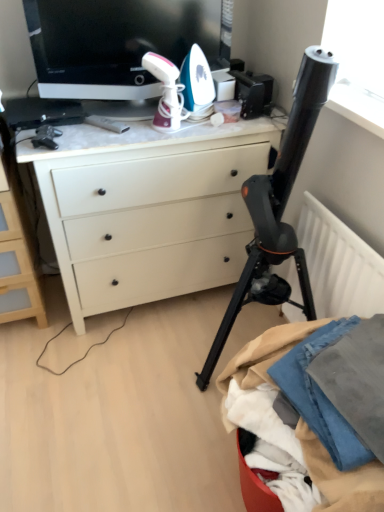
Question: From a real-world perspective, is denim fabric at lower right located beneath black glossy television at upper center?

Choices:
 (A) no
 (B) yes

Answer: (B)

Question: Is denim fabric at lower right completely or partially outside of black glossy television at upper center?

Choices:
 (A) no
 (B) yes

Answer: (B)

Question: Can you confirm if denim fabric at lower right is positioned to the right of black glossy television at upper center?

Choices:
 (A) yes
 (B) no

Answer: (A)

Question: Is denim fabric at lower right touching black glossy television at upper center?

Choices:
 (A) no
 (B) yes

Answer: (A)

Question: Does denim fabric at lower right have a greater height compared to black glossy television at upper center?

Choices:
 (A) no
 (B) yes

Answer: (A)

Question: From the image's perspective, is denim fabric at lower right located beneath black glossy television at upper center?

Choices:
 (A) yes
 (B) no

Answer: (A)

Question: From the image's perspective, is white matte chest of drawers at left beneath white matte radiator at right?

Choices:
 (A) yes
 (B) no

Answer: (B)

Question: Does white matte chest of drawers at left contain white matte radiator at right?

Choices:
 (A) yes
 (B) no

Answer: (B)

Question: Is white matte chest of drawers at left looking in the opposite direction of white matte radiator at right?

Choices:
 (A) no
 (B) yes

Answer: (A)

Question: From a real-world perspective, is white matte chest of drawers at left on top of white matte radiator at right?

Choices:
 (A) no
 (B) yes

Answer: (B)

Question: Could you tell me if white matte chest of drawers at left is facing white matte radiator at right?

Choices:
 (A) no
 (B) yes

Answer: (A)

Question: Is white matte chest of drawers at left smaller than white matte radiator at right?

Choices:
 (A) no
 (B) yes

Answer: (A)

Question: Does black matte tripod at center come behind white matte radiator at right?

Choices:
 (A) no
 (B) yes

Answer: (A)